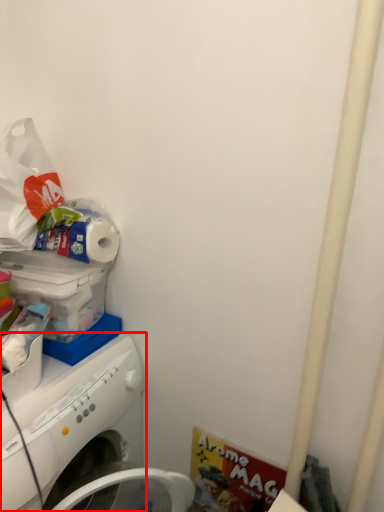
Question: From the image's perspective, where is washing machine (annotated by the red box) located relative to toilet paper?

Choices:
 (A) below
 (B) above

Answer: (A)